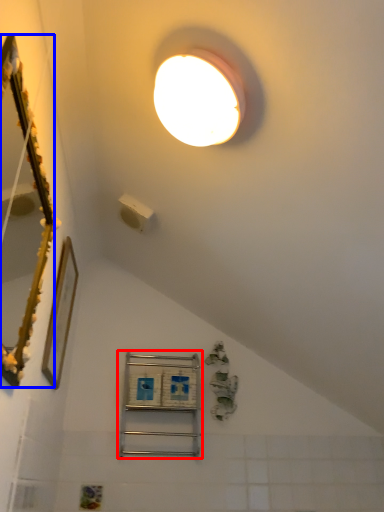
Question: Which object is closer to the camera taking this photo, shelf (highlighted by a red box) or mirror (highlighted by a blue box)?

Choices:
 (A) shelf
 (B) mirror

Answer: (B)